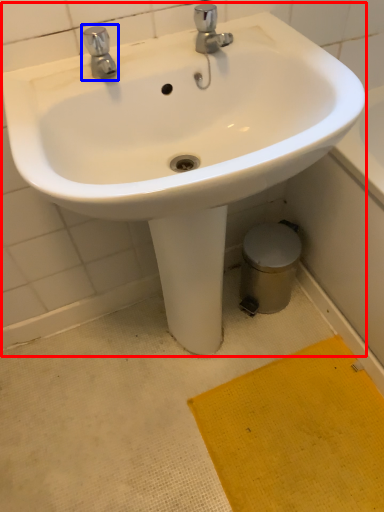
Question: Which object appears farthest to the camera in this image, sink (highlighted by a red box) or tap (highlighted by a blue box)?

Choices:
 (A) sink
 (B) tap

Answer: (B)